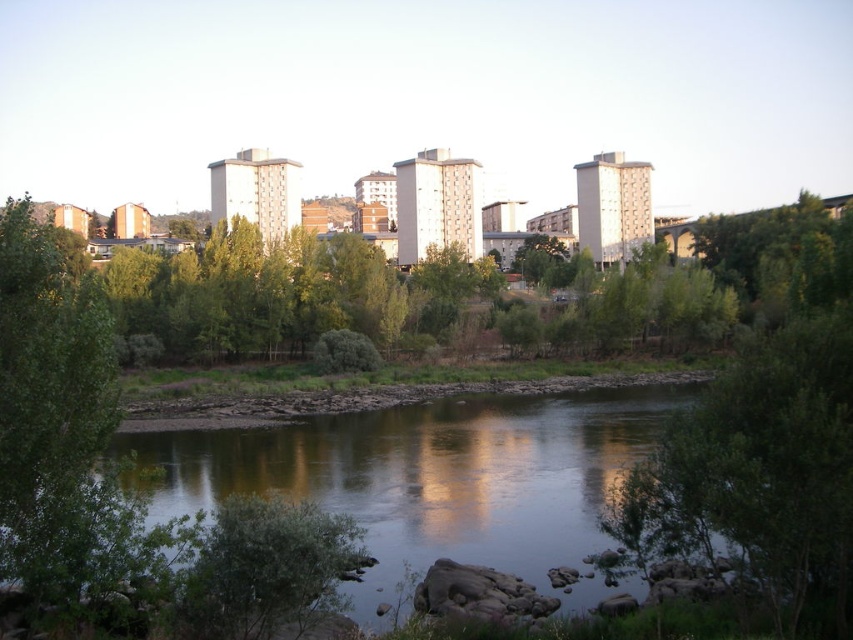
Question: Does smooth reflective water at center have a larger size compared to green leafy tree at right?

Choices:
 (A) no
 (B) yes

Answer: (A)

Question: Is smooth reflective water at center to the right of green leafy tree at right from the viewer's perspective?

Choices:
 (A) yes
 (B) no

Answer: (B)

Question: Can you confirm if smooth reflective water at center is positioned above green leafy tree at right?

Choices:
 (A) yes
 (B) no

Answer: (B)

Question: Which point is closer to the camera?

Choices:
 (A) green leafy tree at right
 (B) smooth reflective water at center

Answer: (A)

Question: Which point is closer to the camera?

Choices:
 (A) green leafy tree at right
 (B) smooth reflective water at center

Answer: (A)

Question: Which point is farther to the camera?

Choices:
 (A) smooth reflective water at center
 (B) green leafy tree at right

Answer: (A)